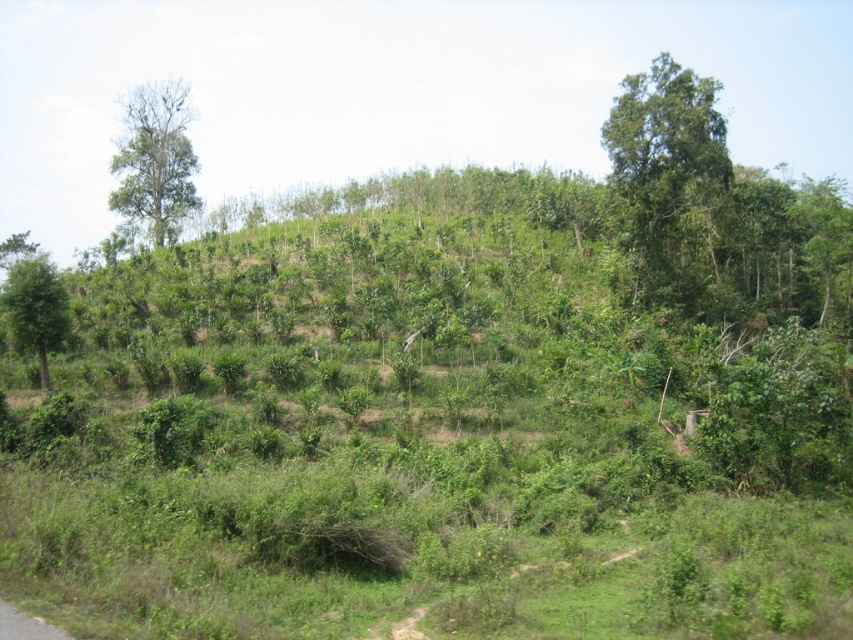
Question: From the image, what is the correct spatial relationship of bare wood tree at upper left in relation to green leafy tree at left?

Choices:
 (A) right
 (B) left

Answer: (B)

Question: Which of the following is the farthest from the observer?

Choices:
 (A) (630, 227)
 (B) (132, 193)
 (C) (28, 308)

Answer: (B)

Question: Can you confirm if bare wood tree at upper left is thinner than green leafy tree at left?

Choices:
 (A) yes
 (B) no

Answer: (B)

Question: Estimate the real-world distances between objects in this image. Which object is farther from the green leafy tree at upper right?

Choices:
 (A) bare wood tree at upper left
 (B) green leafy tree at left

Answer: (A)

Question: From the image, what is the correct spatial relationship of green leafy tree at upper right in relation to bare wood tree at upper left?

Choices:
 (A) right
 (B) left

Answer: (A)

Question: Based on their relative distances, which object is nearer to the green leafy tree at left?

Choices:
 (A) bare wood tree at upper left
 (B) green leafy tree at upper right

Answer: (B)